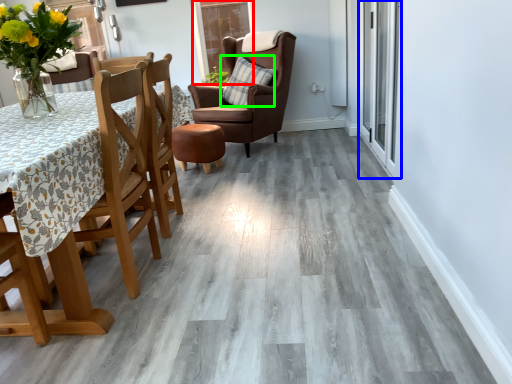
Question: Based on their relative distances, which object is nearer to glass door (highlighted by a red box)? Choose from glass door (highlighted by a blue box) and pillow (highlighted by a green box).

Choices:
 (A) glass door
 (B) pillow

Answer: (B)